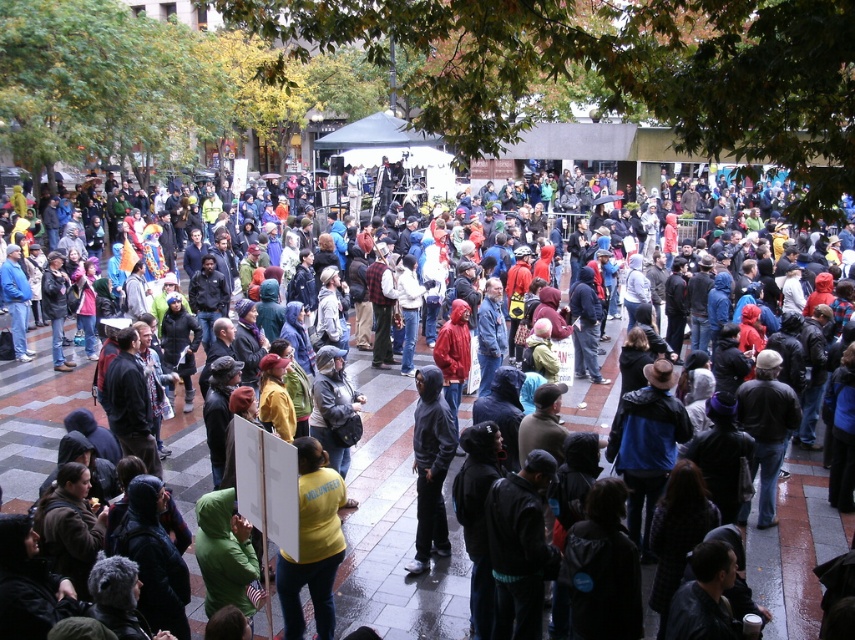
Who is shorter, yellow matte shirt at center or dark gray hoodie at center?

With less height is yellow matte shirt at center.

Measure the distance between yellow matte shirt at center and camera.

The distance of yellow matte shirt at center from camera is 19.17 feet.

Locate an element on the screen. yellow matte shirt at center is located at coordinates (311, 544).

How much distance is there between yellow hoodie at center and yellow matte shirt at center?

yellow hoodie at center is 8.74 feet away from yellow matte shirt at center.

Based on the photo, is yellow hoodie at center positioned at the back of yellow matte shirt at center?

Yes, yellow hoodie at center is further from the viewer.

This screenshot has width=855, height=640. I want to click on yellow hoodie at center, so click(x=393, y=524).

Which is above, yellow hoodie at center or dark gray hoodie at center?

yellow hoodie at center is above.

Which of these two, yellow hoodie at center or dark gray hoodie at center, stands shorter?

With less height is dark gray hoodie at center.

Which is behind, point (366, 592) or point (434, 540)?

The point (434, 540) is more distant.

The image size is (855, 640). I want to click on yellow hoodie at center, so click(393, 524).